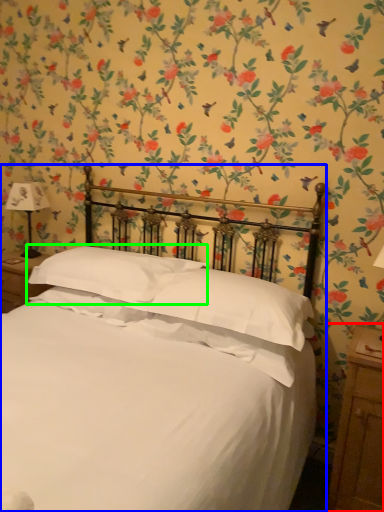
Question: Based on their relative distances, which object is nearer to nightstand (highlighted by a red box)? Choose from bed (highlighted by a blue box) and pillow (highlighted by a green box).

Choices:
 (A) bed
 (B) pillow

Answer: (A)